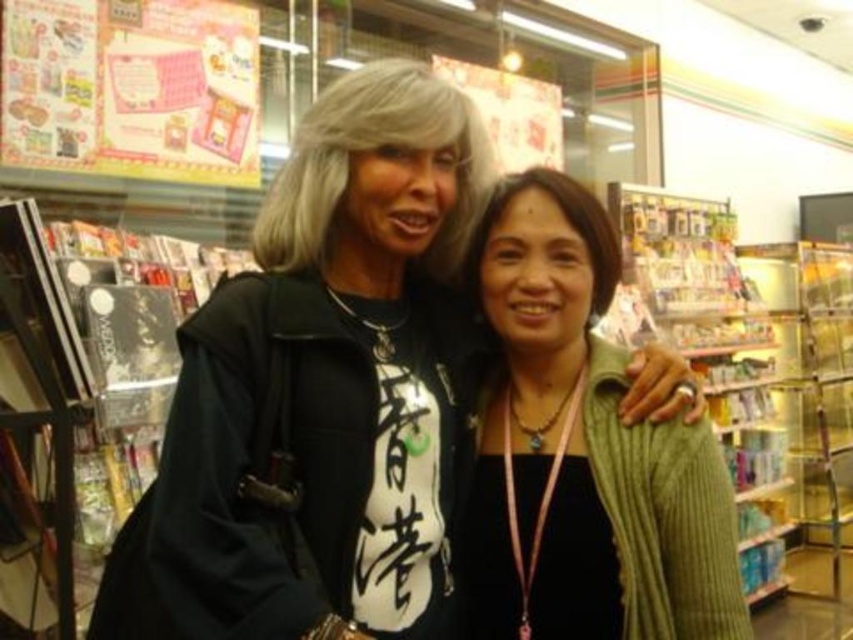
You are a fashion designer observing two people in a convenience store. You notice the matte black jacket at center and the green knitted sweater at center. Which clothing item is taller?

The matte black jacket at center is taller than the green knitted sweater at center.

You are a store employee who needs to fit both the matte black jacket at center and the green knitted sweater at center into a display rack that can only accommodate items with a combined width of 40 cm. Given their widths, will they fit together?

The matte black jacket at center is wider than the green knitted sweater at center. Since the combined width of both items exceeds 40 cm, they cannot fit together on the display rack.

You are designing a new display rack for a clothing store that needs to accommodate both the matte black jacket at center and the green knitted sweater at center. If the rack has a width of 1.2 meters, will both items fit side by side without overlapping?

The matte black jacket at center is larger in size than the green knitted sweater at center. However, since the exact dimensions of each item aren